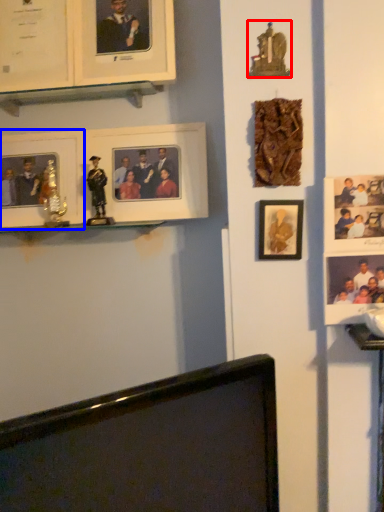
Question: Which of the following is the farthest to the observer, portrait (highlighted by a red box) or picture frame (highlighted by a blue box)?

Choices:
 (A) portrait
 (B) picture frame

Answer: (B)